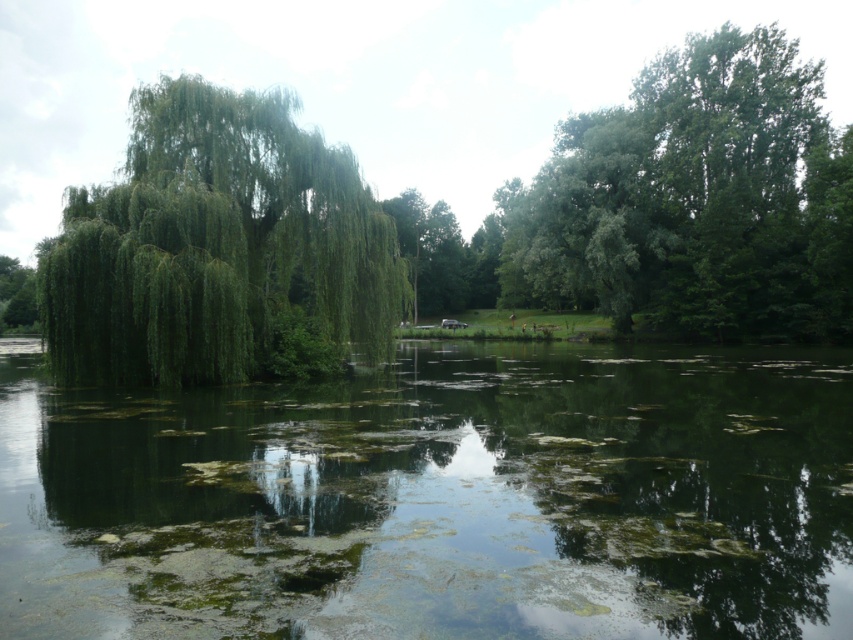
Question: Is green algae-covered water at center to the right of green leafy willow at left from the viewer's perspective?

Choices:
 (A) no
 (B) yes

Answer: (B)

Question: Can you confirm if green algae-covered water at center is thinner than green leafy willow at left?

Choices:
 (A) no
 (B) yes

Answer: (A)

Question: Which point is farther to the camera?

Choices:
 (A) green leafy willow at left
 (B) green algae-covered water at center

Answer: (A)

Question: Is green algae-covered water at center positioned in front of green leafy willow at left?

Choices:
 (A) no
 (B) yes

Answer: (B)